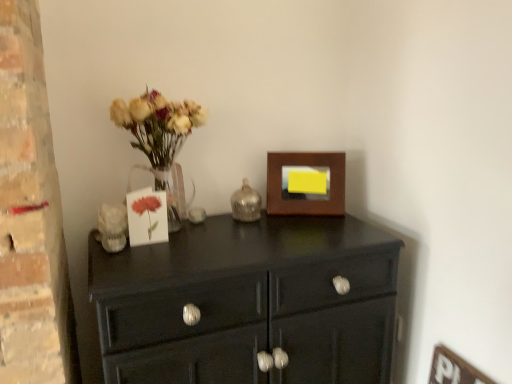
Question: Considering the relative sizes of glossy black cabinet at center and shiny metallic candle holder at center in the image provided, is glossy black cabinet at center taller than shiny metallic candle holder at center?

Choices:
 (A) yes
 (B) no

Answer: (A)

Question: From the image's perspective, is glossy black cabinet at center beneath shiny metallic candle holder at center?

Choices:
 (A) no
 (B) yes

Answer: (B)

Question: From a real-world perspective, is glossy black cabinet at center on shiny metallic candle holder at center?

Choices:
 (A) no
 (B) yes

Answer: (A)

Question: Does glossy black cabinet at center have a greater width compared to shiny metallic candle holder at center?

Choices:
 (A) yes
 (B) no

Answer: (A)

Question: From a real-world perspective, does glossy black cabinet at center sit lower than shiny metallic candle holder at center?

Choices:
 (A) no
 (B) yes

Answer: (B)

Question: Does point (339, 309) appear closer or farther from the camera than point (301, 185)?

Choices:
 (A) closer
 (B) farther

Answer: (A)

Question: From a real-world perspective, is glossy black cabinet at center above or below wooden picture frame at upper right?

Choices:
 (A) below
 (B) above

Answer: (A)

Question: Is glossy black cabinet at center taller or shorter than wooden picture frame at upper right?

Choices:
 (A) tall
 (B) short

Answer: (A)

Question: Is glossy black cabinet at center in front of or behind wooden picture frame at upper right in the image?

Choices:
 (A) front
 (B) behind

Answer: (A)

Question: Is white matte card at center to the left or to the right of glossy black cabinet at center in the image?

Choices:
 (A) left
 (B) right

Answer: (A)

Question: Relative to glossy black cabinet at center, is white matte card at center in front or behind?

Choices:
 (A) front
 (B) behind

Answer: (B)

Question: From a real-world perspective, relative to glossy black cabinet at center, is white matte card at center vertically above or below?

Choices:
 (A) above
 (B) below

Answer: (A)

Question: Is white matte card at center spatially inside glossy black cabinet at center, or outside of it?

Choices:
 (A) inside
 (B) outside

Answer: (B)

Question: From the image's perspective, is matte glass vase with dried flowers at left above or below glossy black cabinet at center?

Choices:
 (A) above
 (B) below

Answer: (A)

Question: In terms of width, does matte glass vase with dried flowers at left look wider or thinner when compared to glossy black cabinet at center?

Choices:
 (A) thin
 (B) wide

Answer: (A)